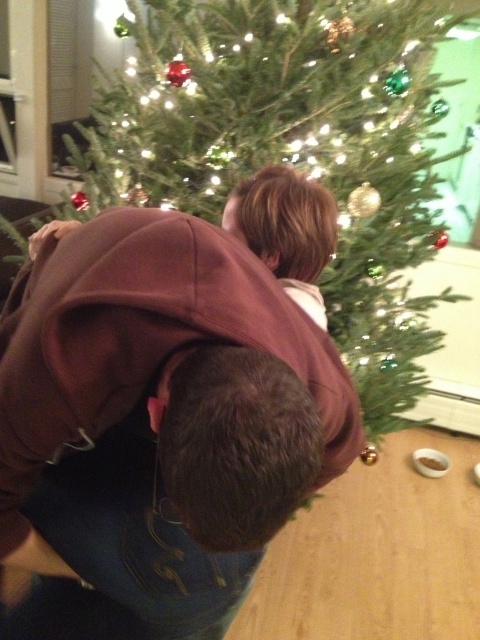
Looking at this image, is brown hoodie at center to the left of green matte christmas tree at center from the viewer's perspective?

Yes, brown hoodie at center is to the left of green matte christmas tree at center.

Is point (48, 291) farther from camera compared to point (412, 65)?

That is False.

Which is behind, point (136, 273) or point (228, 128)?

The point (228, 128) is more distant.

This screenshot has width=480, height=640. Find the location of `brown hoodie at center`. brown hoodie at center is located at coordinates (163, 413).